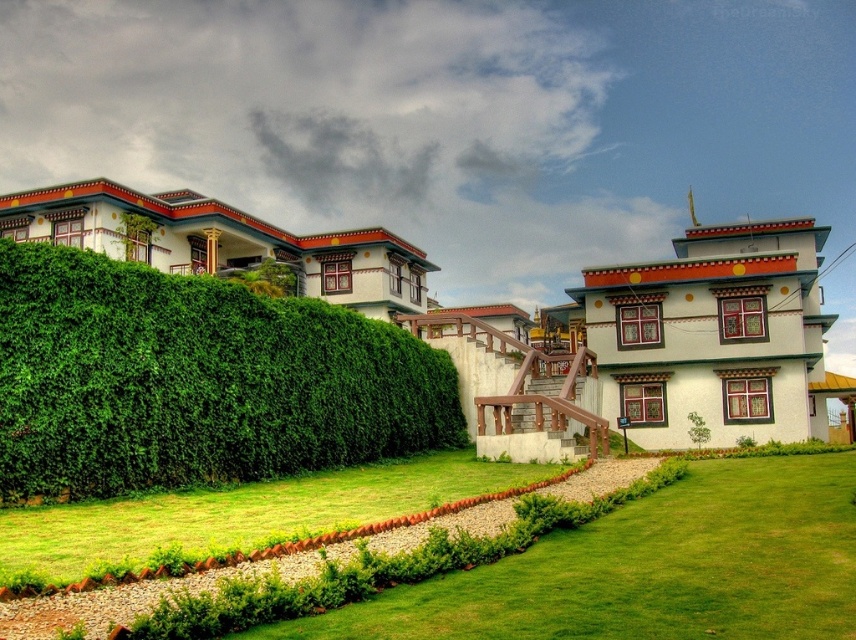
Does point (348, 353) come in front of point (807, 602)?

No, it is behind (807, 602).

Does green leafy hedge at left have a greater width compared to green grass at center?

No.

What are the coordinates of `green leafy hedge at left` in the screenshot? It's located at (195, 380).

Locate an element on the screen. Image resolution: width=856 pixels, height=640 pixels. green leafy hedge at left is located at coordinates (195, 380).